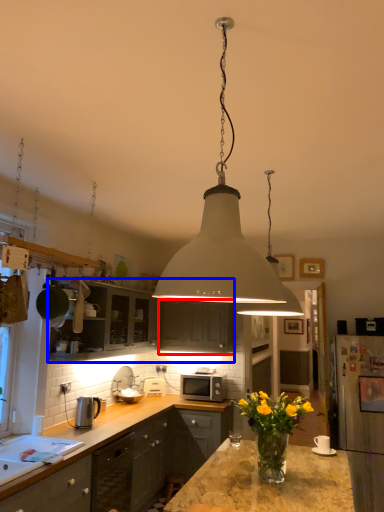
Question: Which point is further to the camera, cabinetry (highlighted by a red box) or cabinetry (highlighted by a blue box)?

Choices:
 (A) cabinetry
 (B) cabinetry

Answer: (A)